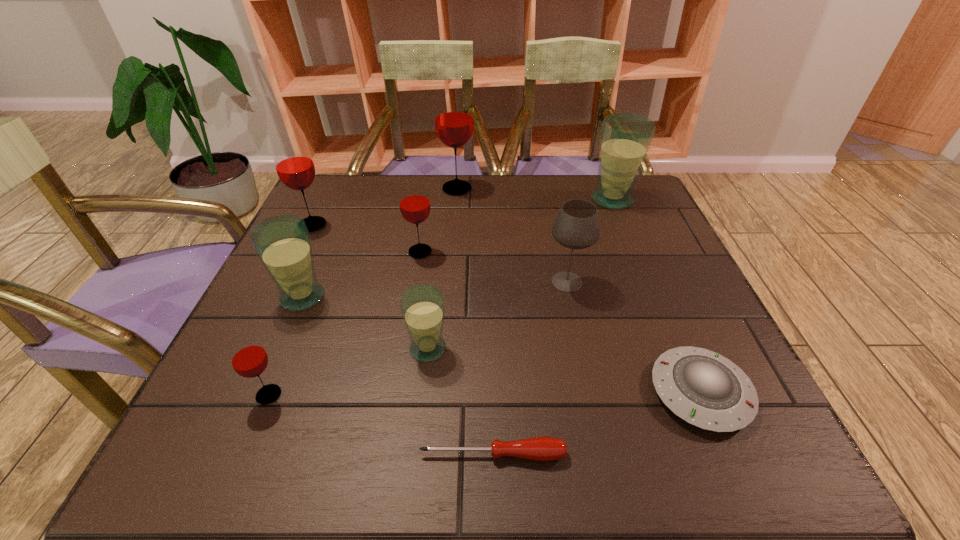
Find the location of a particular element. The height and width of the screenshot is (540, 960). vacant space that satisfies the following two spatial constraints: 1. on the back side of the eighth object from left to right; 2. on the right side of the nearest red glass is located at coordinates (315, 282).